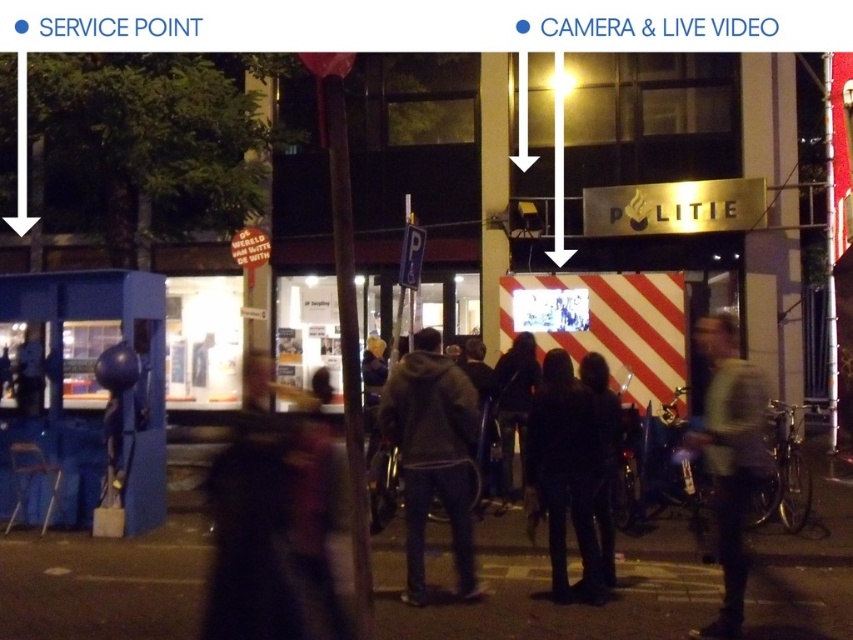
Question: Is dark fabric coat at center wider than dark blue jeans at center?

Choices:
 (A) no
 (B) yes

Answer: (A)

Question: Which of the following is the farthest from the observer?

Choices:
 (A) dark gray hoodie at center
 (B) dark fabric coat at center

Answer: (B)

Question: Which of the following is the farthest from the observer?

Choices:
 (A) click(x=606, y=506)
 (B) click(x=461, y=436)
 (C) click(x=730, y=525)
 (D) click(x=552, y=508)

Answer: (A)

Question: Is gray fabric jacket at lower right positioned in front of dark blue jeans at center?

Choices:
 (A) yes
 (B) no

Answer: (A)

Question: Considering the relative positions of dark gray hoodie at center and dark blue jeans at center in the image provided, where is dark gray hoodie at center located with respect to dark blue jeans at center?

Choices:
 (A) above
 (B) below

Answer: (A)

Question: Which object is closer to the camera taking this photo?

Choices:
 (A) dark blue jeans at center
 (B) dark gray hoodie at center
 (C) dark fabric coat at center

Answer: (B)